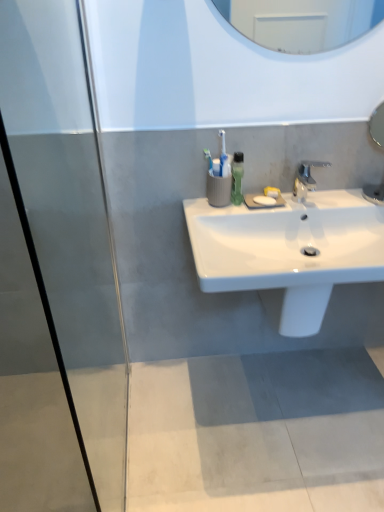
I want to click on vacant space underneath white glossy sink at center (from a real-world perspective), so click(x=296, y=392).